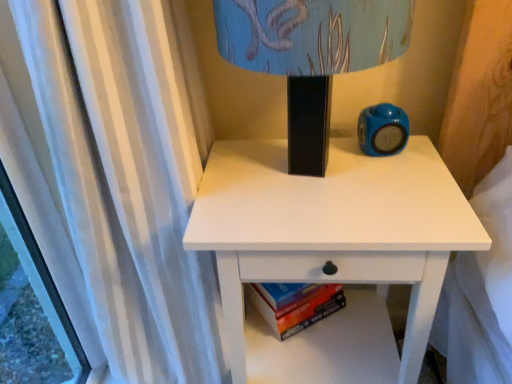
The image size is (512, 384). What are the coordinates of `vacant space in matte black lampshade at upper center (from a real-world perspective)` in the screenshot? It's located at (305, 180).